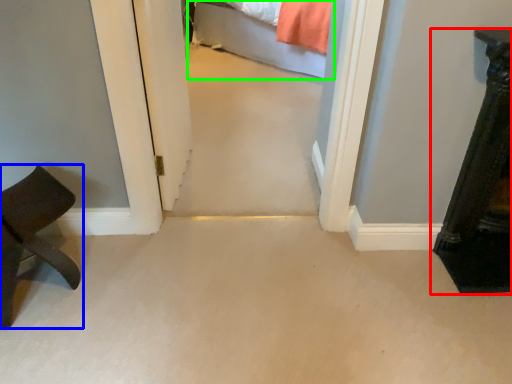
Question: Based on their relative distances, which object is farther from furniture (highlighted by a red box)? Choose from furniture (highlighted by a blue box) and bed (highlighted by a green box).

Choices:
 (A) furniture
 (B) bed

Answer: (B)